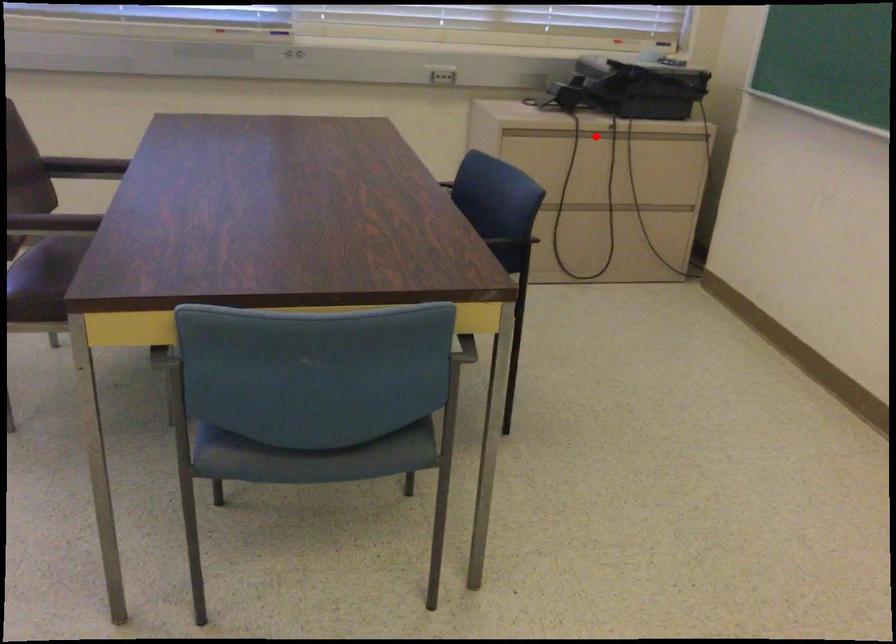
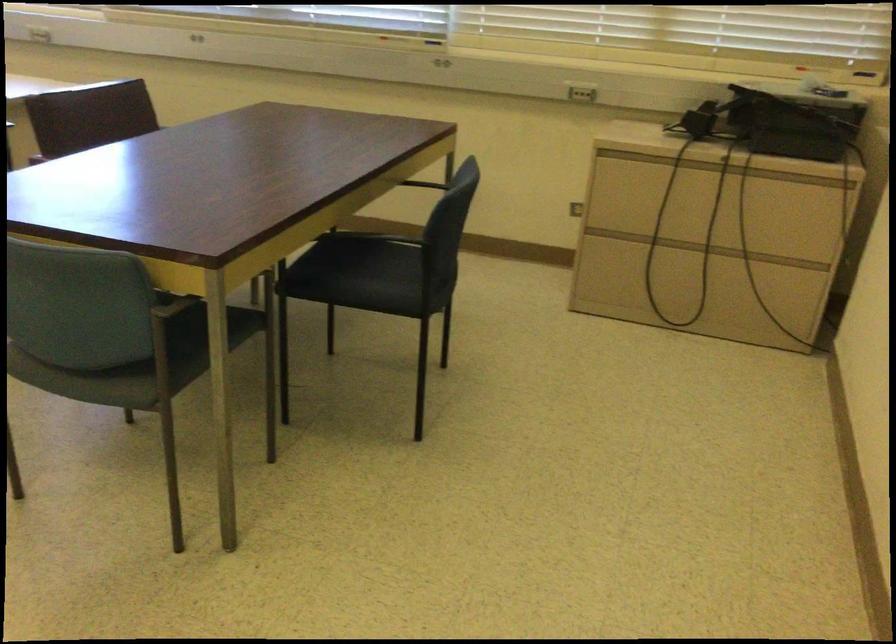
Question: I am providing you with two images of the same scene from different viewpoints. Image1 has a red point marked. In image2, the corresponding 3D location appears at what relative position? Reply with the corresponding letter.

Choices:
 (A) Closer
 (B) Farther

Answer: (A)